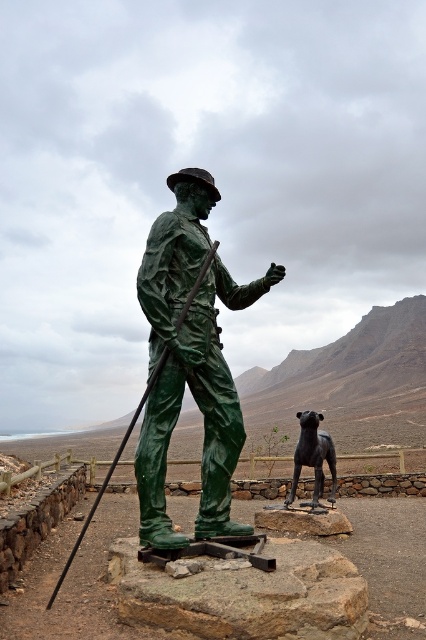
You are an art curator planning to display the green polished bronze statue at center and the shiny black statue at center in a gallery. The gallery has a 1.5 meter wide space allocated for these statues. Which statue should be placed first to ensure both fit side by side?

The green polished bronze statue at center has a smaller width than the shiny black statue at center. To fit both statues side by side in the 1.5 meter space, place the wider shiny black statue at center first, then the narrower green polished bronze statue at center.

You are an artist planning to create a new sculpture for a public park. You observe the green polished bronze statue at center and the granite rock at center in the image. Which object would be more suitable for a sculpture that requires a slender design?

The green polished bronze statue at center is thinner than the granite rock at center, so it would be more suitable for a sculpture requiring a slender design.